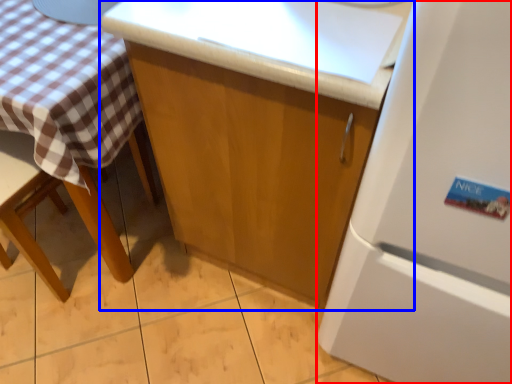
Question: Among these objects, which one is farthest to the camera, refrigerator (highlighted by a red box) or cabinetry (highlighted by a blue box)?

Choices:
 (A) refrigerator
 (B) cabinetry

Answer: (B)